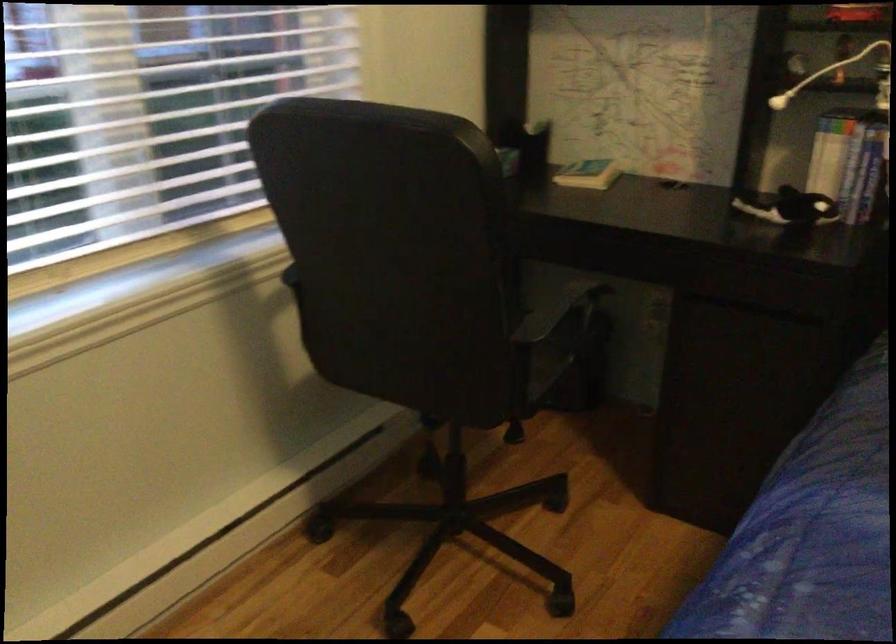
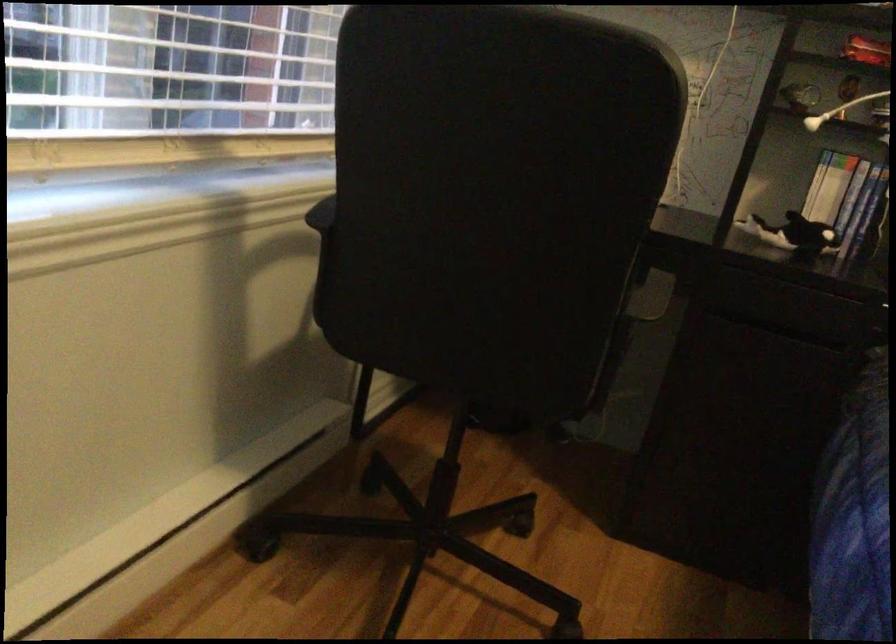
Question: Based on the continuous images, in which direction is the camera rotating? Reply with the corresponding letter.

Choices:
 (A) Left
 (B) Right
 (C) Up
 (D) Down

Answer: (B)